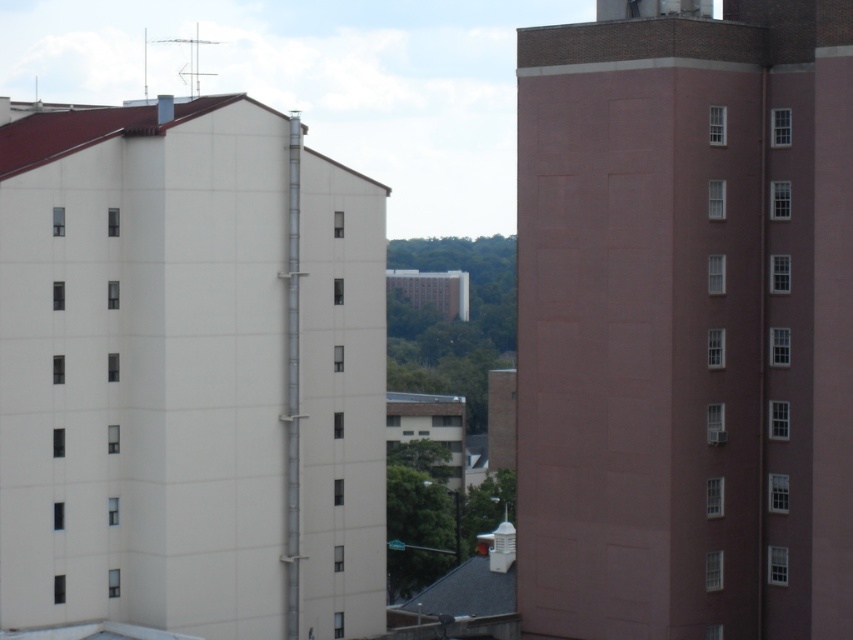
Question: Which point is closer to the camera?

Choices:
 (A) (670, 637)
 (B) (372, 353)

Answer: (A)

Question: Does smooth pink building at right have a larger size compared to white smooth building at left?

Choices:
 (A) no
 (B) yes

Answer: (A)

Question: Does smooth pink building at right appear on the left side of white smooth building at left?

Choices:
 (A) yes
 (B) no

Answer: (B)

Question: Does smooth pink building at right appear on the right side of white smooth building at left?

Choices:
 (A) yes
 (B) no

Answer: (A)

Question: Which point is closer to the camera?

Choices:
 (A) smooth pink building at right
 (B) white smooth building at left

Answer: (A)

Question: Which point is closer to the camera?

Choices:
 (A) (67, 356)
 (B) (676, 477)

Answer: (A)